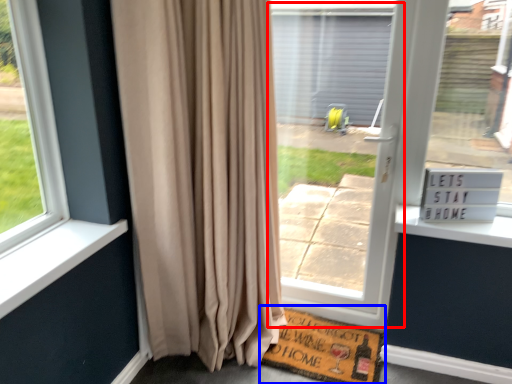
Question: Which of the following is the closest to the observer, screen door (highlighted by a red box) or doormat (highlighted by a blue box)?

Choices:
 (A) screen door
 (B) doormat

Answer: (A)